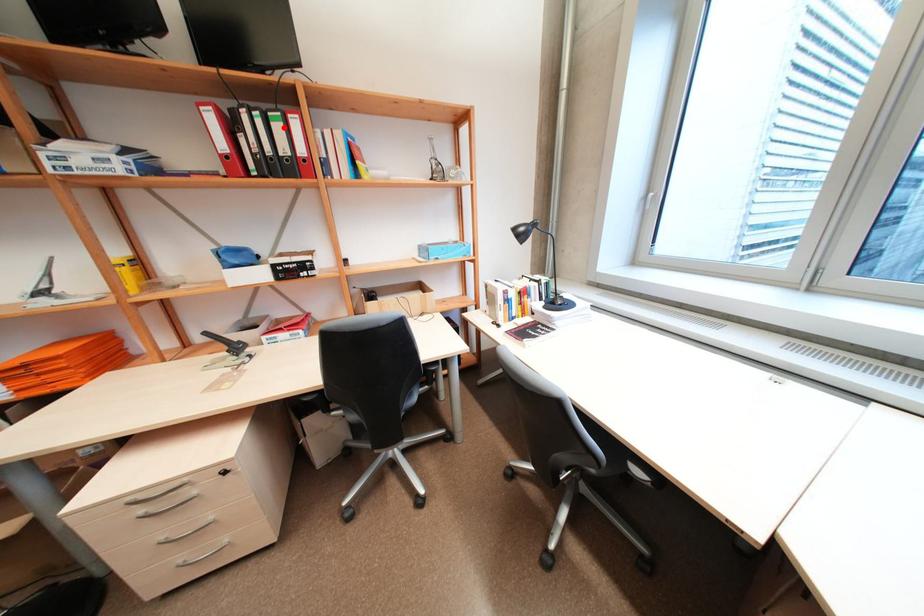
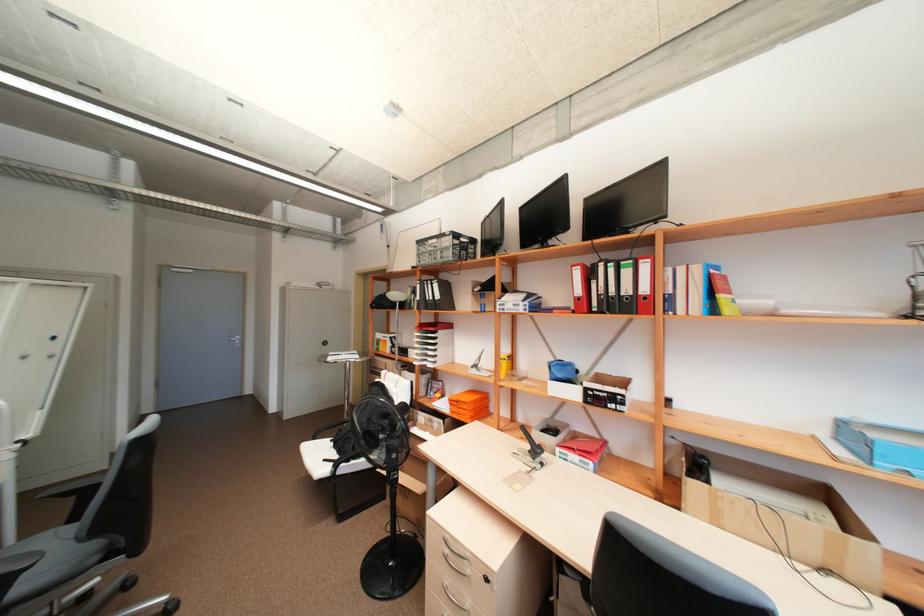
Where in the second image is the point corresponding to the highlighted location from the first image?

(633, 273)